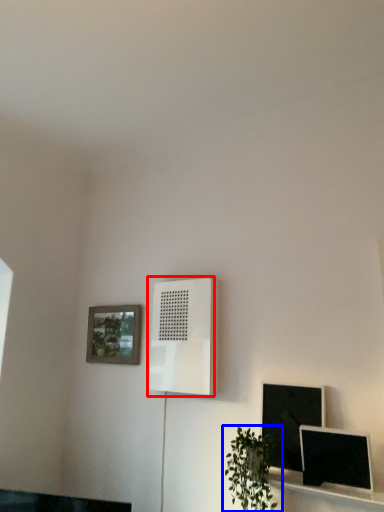
Question: Which of the following is the closest to the observer, air conditioner (highlighted by a red box) or houseplant (highlighted by a blue box)?

Choices:
 (A) air conditioner
 (B) houseplant

Answer: (B)